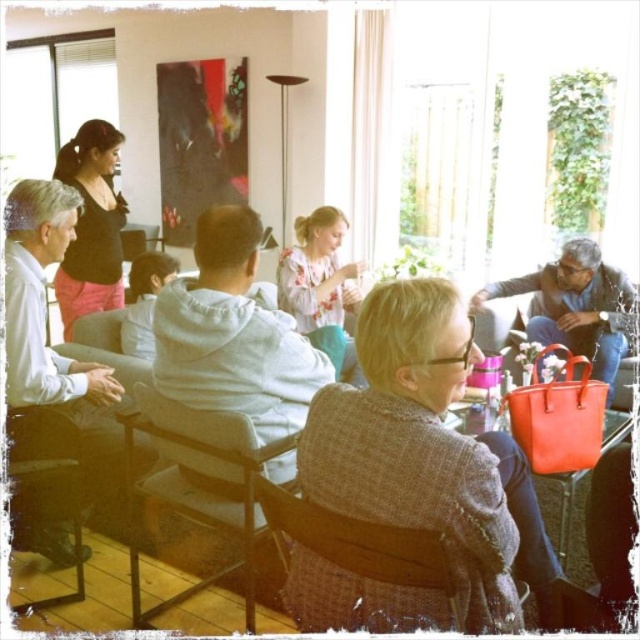
Based on the scene description, where is the matte black top at upper left located in terms of its 2D coordinates?

The matte black top at upper left is located at the 2D coordinates point [92,225].

You are organizing a small gathering and need to seat two people in the center of the room. The wooden chair at center and the woven fabric chair at center are available. Which chair can accommodate a larger person more comfortably?

The wooden chair at center has a greater width than the woven fabric chair at center, making it more suitable for accommodating a larger person comfortably.

You are organizing a small gathering and need to ensure there is enough space for all attendees. You have a woven fabric chair at center and a floral blouse at center in the room. Which object takes up more space?

The floral blouse at center takes up more space than the woven fabric chair at center, as the woven fabric chair at center occupies less space than floral blouse at center.